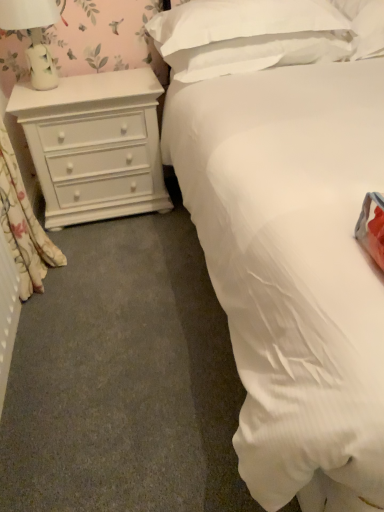
Question: Is white matte chest of drawers at left thinner than white soft pillow at upper center, the first pillow from the right?

Choices:
 (A) no
 (B) yes

Answer: (B)

Question: Considering the relative sizes of white matte chest of drawers at left and white soft pillow at upper center, acting as the 2th pillow starting from the left, in the image provided, is white matte chest of drawers at left taller than white soft pillow at upper center, acting as the 2th pillow starting from the left,?

Choices:
 (A) yes
 (B) no

Answer: (A)

Question: Is white matte chest of drawers at left outside white soft pillow at upper center, acting as the 2th pillow starting from the left?

Choices:
 (A) yes
 (B) no

Answer: (A)

Question: Does white matte chest of drawers at left have a smaller size compared to white soft pillow at upper center, the first pillow from the right?

Choices:
 (A) yes
 (B) no

Answer: (B)

Question: Is white matte chest of drawers at left wider than white soft pillow at upper center, acting as the 2th pillow starting from the left?

Choices:
 (A) no
 (B) yes

Answer: (A)

Question: Choose the correct answer: Is white soft pillow at upper center, marked as the 2th pillow in a right-to-left arrangement, inside white matte chest of drawers at left or outside it?

Choices:
 (A) outside
 (B) inside

Answer: (A)

Question: In the image, is white soft pillow at upper center, marked as the 2th pillow in a right-to-left arrangement, positioned in front of or behind white matte chest of drawers at left?

Choices:
 (A) front
 (B) behind

Answer: (A)

Question: Is white soft pillow at upper center, positioned as the first pillow in left-to-right order, bigger or smaller than white matte chest of drawers at left?

Choices:
 (A) small
 (B) big

Answer: (A)

Question: From the image's perspective, is white soft pillow at upper center, marked as the 2th pillow in a right-to-left arrangement, positioned above or below white matte chest of drawers at left?

Choices:
 (A) below
 (B) above

Answer: (B)

Question: Looking at their shapes, would you say white ceramic lamp at upper left is wider or thinner than white soft pillow at upper center, the first pillow from the right?

Choices:
 (A) wide
 (B) thin

Answer: (B)

Question: Is point (54, 0) closer or farther from the camera than point (352, 0)?

Choices:
 (A) closer
 (B) farther

Answer: (B)

Question: From a real-world perspective, is white ceramic lamp at upper left positioned above or below white soft pillow at upper center, acting as the 2th pillow starting from the left?

Choices:
 (A) below
 (B) above

Answer: (B)

Question: Is white ceramic lamp at upper left bigger or smaller than white soft pillow at upper center, the first pillow from the right?

Choices:
 (A) small
 (B) big

Answer: (A)

Question: Considering the positions of white matte chest of drawers at left and white ceramic lamp at upper left in the image, is white matte chest of drawers at left wider or thinner than white ceramic lamp at upper left?

Choices:
 (A) thin
 (B) wide

Answer: (B)

Question: From their relative heights in the image, would you say white matte chest of drawers at left is taller or shorter than white ceramic lamp at upper left?

Choices:
 (A) tall
 (B) short

Answer: (A)